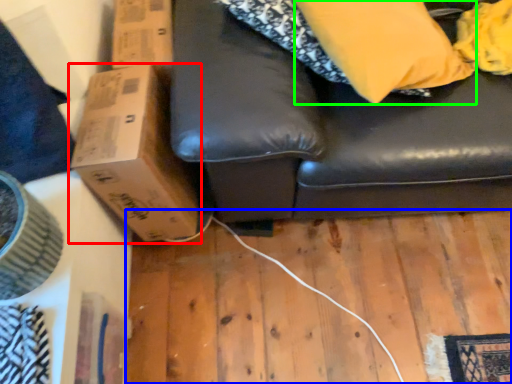
Question: Which object is positioned farthest from cardboard box (highlighted by a red box)? Select from plywood (highlighted by a blue box) and pillow (highlighted by a green box).

Choices:
 (A) plywood
 (B) pillow

Answer: (B)